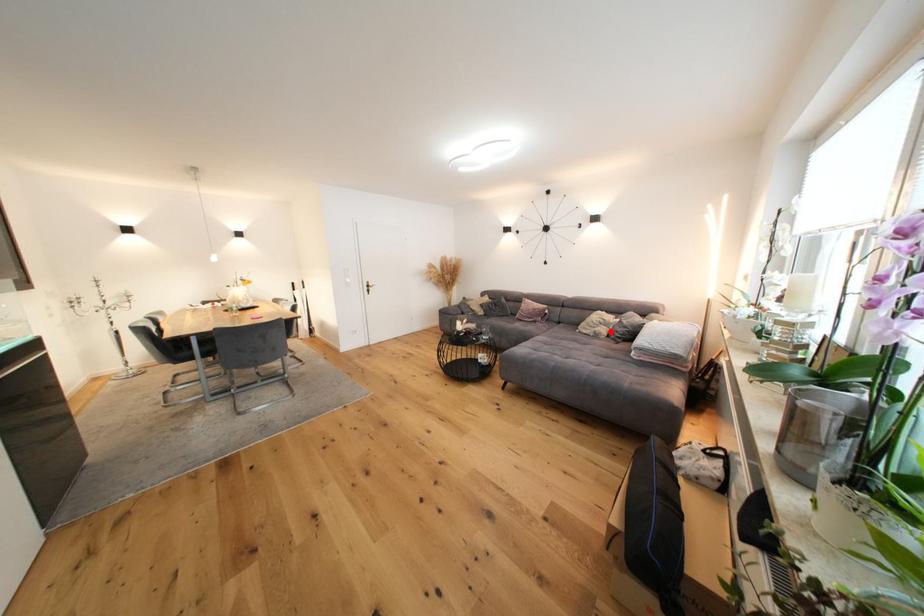
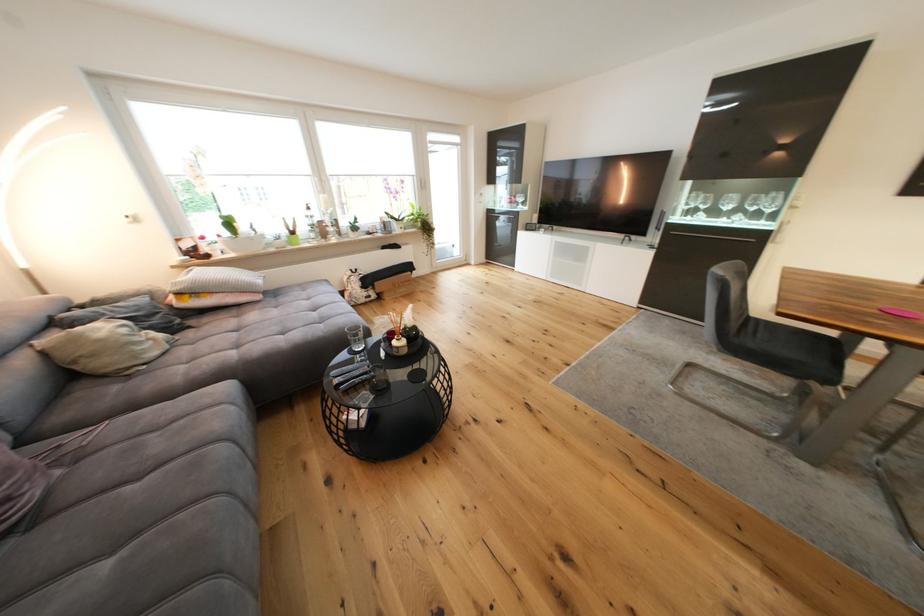
In the second image, find the point that corresponds to the highlighted location in the first image.

(161, 336)